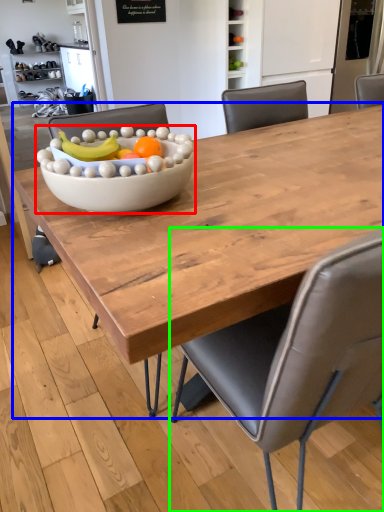
Question: Estimate the real-world distances between objects in this image. Which object is closer to bowl (highlighted by a red box), coffee table (highlighted by a blue box) or chair (highlighted by a green box)?

Choices:
 (A) coffee table
 (B) chair

Answer: (A)